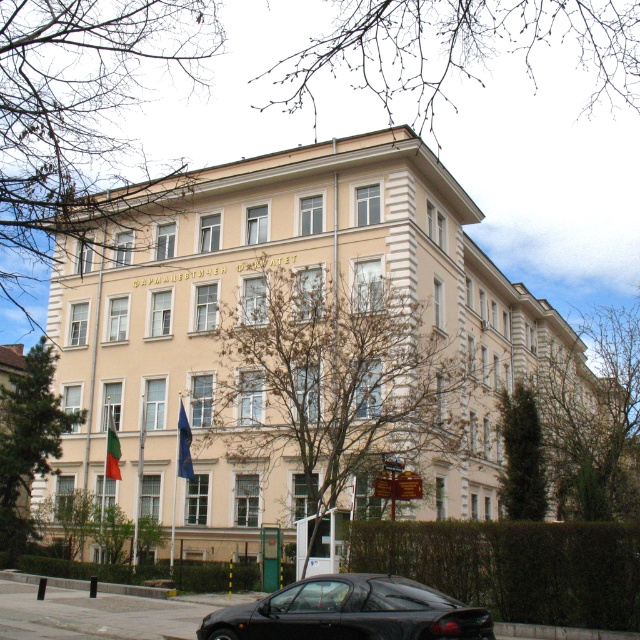
You are a visitor standing at the entrance of the beige stone building at center. You notice the blue fabric flag at center flying in the wind. Which object takes up more space in the image?

The beige stone building at center is larger in size than the blue fabric flag at center, so the beige stone building at center takes up more space in the image.

You are standing in front of the beige stone building at center and want to place a blue fabric flag at center. Based on their widths, can the flag be placed to the side of the building without overlapping?

The beige stone building at center might be wider than blue fabric flag at center, so there is a possibility that placing the flag to the side might not overlap, but the exact width comparison is uncertain.